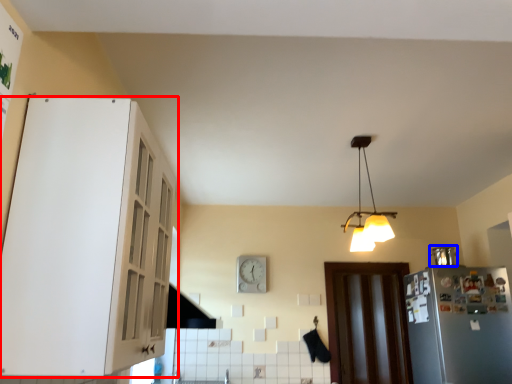
Question: Which point is closer to the camera, cabinetry (highlighted by a red box) or appliance (highlighted by a blue box)?

Choices:
 (A) cabinetry
 (B) appliance

Answer: (A)